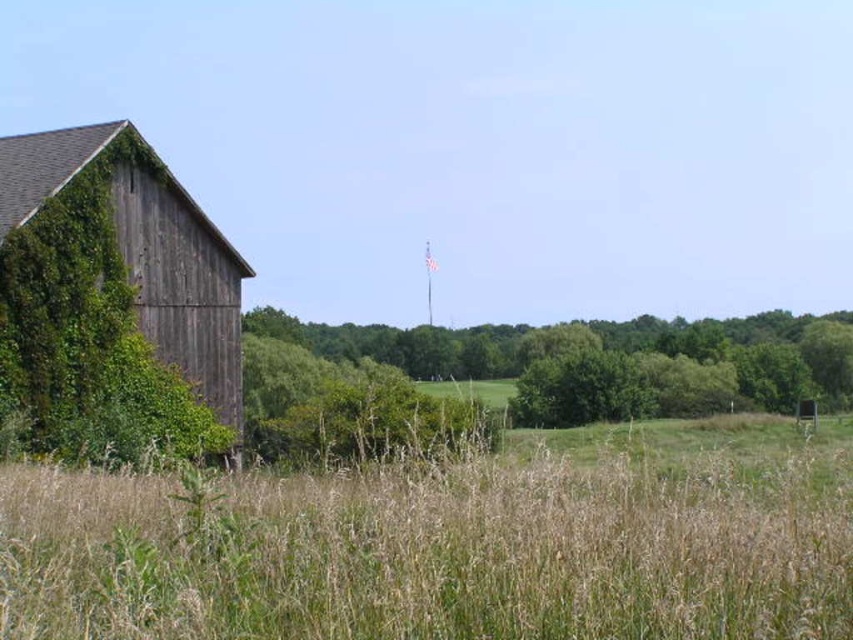
Is dry grass at center smaller than green ivy-covered barn at left?

No, dry grass at center is not smaller than green ivy-covered barn at left.

This screenshot has width=853, height=640. Identify the location of dry grass at center. (451, 545).

Where is `dry grass at center`? The height and width of the screenshot is (640, 853). dry grass at center is located at coordinates (451, 545).